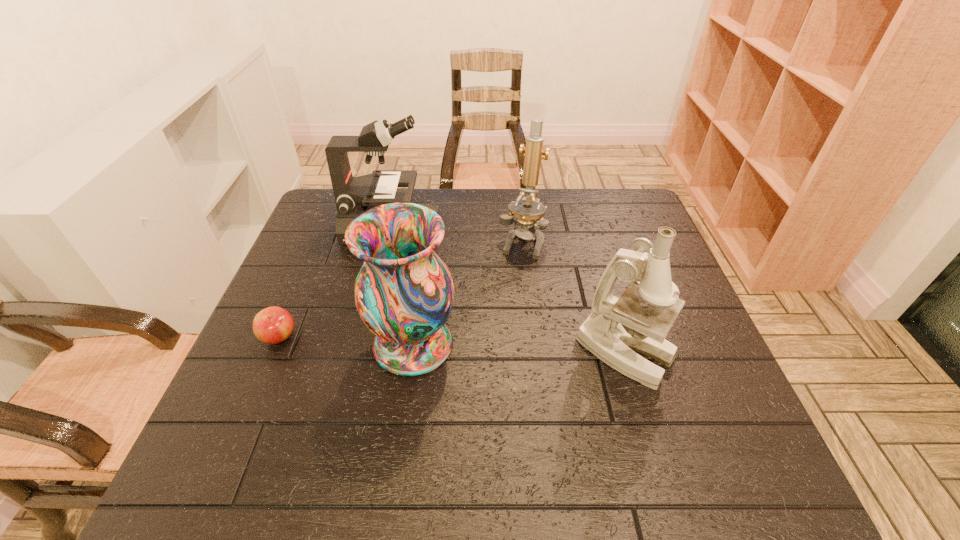
Where is `free region located 0.100m on the front of the vase`? This screenshot has width=960, height=540. free region located 0.100m on the front of the vase is located at coordinates (402, 426).

This screenshot has height=540, width=960. In order to click on vacant point located on the right of the leftmost object in this screenshot , I will do `click(383, 336)`.

Where is `microscope positioned at the left edge`? Image resolution: width=960 pixels, height=540 pixels. microscope positioned at the left edge is located at coordinates (353, 195).

The width and height of the screenshot is (960, 540). I want to click on apple at the left edge, so click(272, 325).

You are a GUI agent. You are given a task and a screenshot of the screen. Output one action in this format:
    pyautogui.click(x=<x>, y=<y>)
    Task: Click on the object that is at the right edge
    Image resolution: width=960 pixels, height=540 pixels.
    Given the screenshot: What is the action you would take?
    pyautogui.click(x=617, y=326)

The image size is (960, 540). Identify the location of object at the far left corner. (353, 195).

Locate an element on the screen. This screenshot has height=540, width=960. free region at the far edge of the desktop is located at coordinates (500, 194).

Find the location of a particular element. This screenshot has height=540, width=960. free region at the left edge of the desktop is located at coordinates (331, 240).

Find the location of a particular element. This screenshot has height=540, width=960. free space at the right edge of the desktop is located at coordinates (632, 241).

In the image, there is a desktop. Where is `vacant region at the far left corner`? The image size is (960, 540). vacant region at the far left corner is located at coordinates (323, 197).